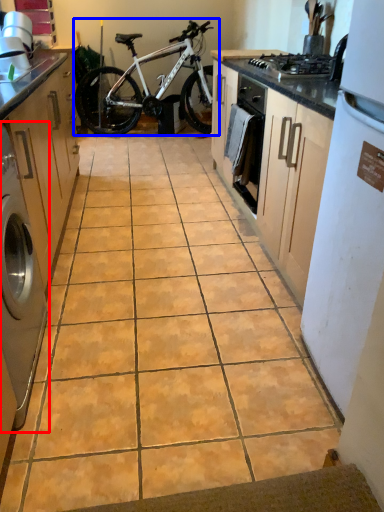
Question: Which object appears closest to the camera in this image, home appliance (highlighted by a red box) or bicycle (highlighted by a blue box)?

Choices:
 (A) home appliance
 (B) bicycle

Answer: (A)